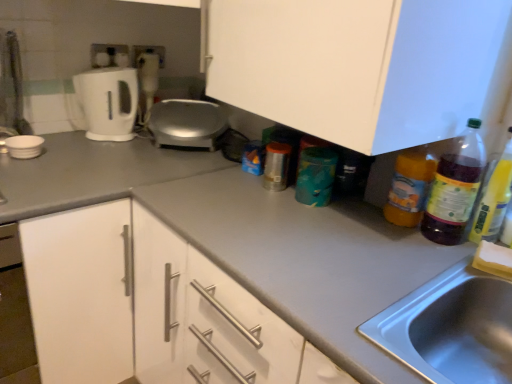
You are a GUI agent. You are given a task and a screenshot of the screen. Output one action in this format:
    pyautogui.click(x=<x>, y=<y>)
    Task: Click on the vacant area that is situated to the right of white matte bowl at left, the first appliance in the left-to-right sequence
    This screenshot has height=384, width=512.
    Given the screenshot: What is the action you would take?
    pyautogui.click(x=72, y=157)